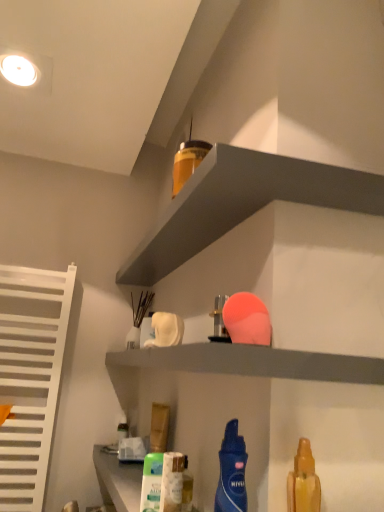
Measure the distance between blue matte lotion at center, which is counted as the 2th cleaning product, starting from the right, and camera.

A distance of 22.43 inches exists between blue matte lotion at center, which is counted as the 2th cleaning product, starting from the right, and camera.

The image size is (384, 512). Describe the element at coordinates (303, 481) in the screenshot. I see `translucent yellow spray bottle at lower right, arranged as the 4th cleaning product when viewed from the left` at that location.

Image resolution: width=384 pixels, height=512 pixels. I want to click on white slatted radiator at left, so 30,377.

What do you see at coordinates (172, 482) in the screenshot? This screenshot has height=512, width=384. I see `translucent plastic spray bottle at center, which is the 4th cleaning product from top to bottom` at bounding box center [172, 482].

Where is `matte gray shelf at upper center, positioned as the 2th shelf in bottom-to-top order`? Image resolution: width=384 pixels, height=512 pixels. matte gray shelf at upper center, positioned as the 2th shelf in bottom-to-top order is located at coordinates (242, 204).

From a real-world perspective, which cleaning product is the 3rd one underneath the white matte shelf at upper center, marked as the 2th shelf in a top-to-bottom arrangement? Please provide its 2D coordinates.

[(172, 482)]

From the image's perspective, is white matte shelf at upper center, the first shelf positioned from the bottom, above or below translucent plastic spray bottle at center, acting as the 4th cleaning product starting from the right?

From the image's perspective, white matte shelf at upper center, the first shelf positioned from the bottom, appears above translucent plastic spray bottle at center, acting as the 4th cleaning product starting from the right.

Is point (181, 354) positioned after point (181, 460)?

That is False.

Can you confirm if white matte shelf at upper center, the first shelf positioned from the bottom, is thinner than translucent plastic spray bottle at center, which is the 4th cleaning product from top to bottom?

In fact, white matte shelf at upper center, the first shelf positioned from the bottom, might be wider than translucent plastic spray bottle at center, which is the 4th cleaning product from top to bottom.

Can you see matte gray shelf at upper center, positioned as the 2th shelf in bottom-to-top order, touching translucent yellow spray bottle at lower right, the fourth cleaning product in the back-to-front sequence?

No, matte gray shelf at upper center, positioned as the 2th shelf in bottom-to-top order, is not making contact with translucent yellow spray bottle at lower right, the fourth cleaning product in the back-to-front sequence.

Is matte gray shelf at upper center, which is counted as the 1th shelf, starting from the top, oriented away from translucent yellow spray bottle at lower right, which ranks as the 1th cleaning product in right-to-left order?

That's not correct — matte gray shelf at upper center, which is counted as the 1th shelf, starting from the top, is not looking away from translucent yellow spray bottle at lower right, which ranks as the 1th cleaning product in right-to-left order.

How different are the orientations of matte gray shelf at upper center, positioned as the 2th shelf in bottom-to-top order, and translucent yellow spray bottle at lower right, arranged as the 4th cleaning product when viewed from the left, in degrees?

90 degrees separate the facing orientations of matte gray shelf at upper center, positioned as the 2th shelf in bottom-to-top order, and translucent yellow spray bottle at lower right, arranged as the 4th cleaning product when viewed from the left.

From a real-world perspective, between white slatted radiator at left and white matte shelf at upper center, marked as the 2th shelf in a top-to-bottom arrangement, who is vertically higher?

In real-world perspective, white matte shelf at upper center, marked as the 2th shelf in a top-to-bottom arrangement, is above.

Is white slatted radiator at left thinner than white matte shelf at upper center, marked as the 2th shelf in a top-to-bottom arrangement?

Yes.

Considering the positions of objects white slatted radiator at left and white matte shelf at upper center, marked as the 2th shelf in a top-to-bottom arrangement, in the image provided, who is in front, white slatted radiator at left or white matte shelf at upper center, marked as the 2th shelf in a top-to-bottom arrangement,?

white matte shelf at upper center, marked as the 2th shelf in a top-to-bottom arrangement.

Is white slatted radiator at left beside white matte shelf at upper center, the first shelf positioned from the bottom?

No.

Between white slatted radiator at left and translucent yellow spray bottle at lower right, which ranks as the 1th cleaning product in right-to-left order, which one has smaller size?

translucent yellow spray bottle at lower right, which ranks as the 1th cleaning product in right-to-left order.

Is white slatted radiator at left oriented away from translucent yellow spray bottle at lower right, positioned as the second cleaning product in bottom-to-top order?

white slatted radiator at left does not have its back to translucent yellow spray bottle at lower right, positioned as the second cleaning product in bottom-to-top order.

Can you confirm if white slatted radiator at left is positioned to the left of translucent yellow spray bottle at lower right, positioned as the second cleaning product in bottom-to-top order?

Yes.

Which is behind, point (22, 376) or point (301, 477)?

Positioned behind is point (22, 376).

Is blue matte lotion at center, the second cleaning product positioned from the top, facing away from translucent yellow spray bottle at lower right, which is the 1th cleaning product in front-to-back order?

Yes, blue matte lotion at center, the second cleaning product positioned from the top, is facing away from translucent yellow spray bottle at lower right, which is the 1th cleaning product in front-to-back order.

Considering the relative sizes of blue matte lotion at center, which is counted as the 2th cleaning product, starting from the right, and translucent yellow spray bottle at lower right, which ranks as the 1th cleaning product in right-to-left order, in the image provided, is blue matte lotion at center, which is counted as the 2th cleaning product, starting from the right, taller than translucent yellow spray bottle at lower right, which ranks as the 1th cleaning product in right-to-left order,?

Yes, blue matte lotion at center, which is counted as the 2th cleaning product, starting from the right, is taller than translucent yellow spray bottle at lower right, which ranks as the 1th cleaning product in right-to-left order.

Is point (214, 505) farther from viewer compared to point (295, 484)?

Yes, it is.

Would you consider blue matte lotion at center, placed as the 3th cleaning product when sorted from left to right, to be distant from translucent yellow spray bottle at lower right, arranged as the 4th cleaning product when viewed from the left?

Actually, blue matte lotion at center, placed as the 3th cleaning product when sorted from left to right, and translucent yellow spray bottle at lower right, arranged as the 4th cleaning product when viewed from the left, are a little close together.

Consider the image. From a real-world perspective, relative to white matte shelf at upper center, marked as the 2th shelf in a top-to-bottom arrangement, is matte gray shelf at upper center, positioned as the 2th shelf in bottom-to-top order, vertically above or below?

From a real-world perspective, matte gray shelf at upper center, positioned as the 2th shelf in bottom-to-top order, is physically above white matte shelf at upper center, marked as the 2th shelf in a top-to-bottom arrangement.

Is matte gray shelf at upper center, positioned as the 2th shelf in bottom-to-top order, situated inside white matte shelf at upper center, marked as the 2th shelf in a top-to-bottom arrangement, or outside?

matte gray shelf at upper center, positioned as the 2th shelf in bottom-to-top order, lies outside white matte shelf at upper center, marked as the 2th shelf in a top-to-bottom arrangement.

Considering the sizes of matte gray shelf at upper center, which is counted as the 1th shelf, starting from the top, and white matte shelf at upper center, the first shelf positioned from the bottom, in the image, is matte gray shelf at upper center, which is counted as the 1th shelf, starting from the top, wider or thinner than white matte shelf at upper center, the first shelf positioned from the bottom,?

Considering their sizes, matte gray shelf at upper center, which is counted as the 1th shelf, starting from the top, looks slimmer than white matte shelf at upper center, the first shelf positioned from the bottom.

Who is taller, matte gray shelf at upper center, which is counted as the 1th shelf, starting from the top, or white matte shelf at upper center, the first shelf positioned from the bottom?

With more height is white matte shelf at upper center, the first shelf positioned from the bottom.

Consider the image. Considering the positions of objects translucent plastic spray bottle at center, acting as the third cleaning product starting from the front, and white slatted radiator at left in the image provided, who is in front, translucent plastic spray bottle at center, acting as the third cleaning product starting from the front, or white slatted radiator at left?

translucent plastic spray bottle at center, acting as the third cleaning product starting from the front, is more forward.

Based on their sizes in the image, would you say translucent plastic spray bottle at center, the 1th cleaning product in the left-to-right sequence, is bigger or smaller than white slatted radiator at left?

In the image, translucent plastic spray bottle at center, the 1th cleaning product in the left-to-right sequence, appears to be smaller than white slatted radiator at left.

How much distance is there between translucent plastic spray bottle at center, the first cleaning product when ordered from bottom to top, and white slatted radiator at left?

The distance of translucent plastic spray bottle at center, the first cleaning product when ordered from bottom to top, from white slatted radiator at left is 32.66 inches.

Can you tell me how much translucent plastic spray bottle at center, acting as the third cleaning product starting from the front, and white slatted radiator at left differ in facing direction?

They differ by 90 degrees in their facing directions.

You are a GUI agent. You are given a task and a screenshot of the screen. Output one action in this format:
    pyautogui.click(x=<x>, y=<y>)
    Task: Click on the 1st shelf counting from the right side of the translucent plastic spray bottle at center, the 1th cleaning product in the left-to-right sequence
    The height and width of the screenshot is (512, 384).
    Given the screenshot: What is the action you would take?
    pyautogui.click(x=253, y=362)

From a real-world perspective, count 2nd shelfs upward from the translucent yellow spray bottle at lower right, arranged as the 4th cleaning product when viewed from the left, and point to it. Please provide its 2D coordinates.

[(242, 204)]

Estimate the real-world distances between objects in this image. Which object is further from translucent plastic spray bottle at center, acting as the third cleaning product starting from the front, translucent plastic bottle at upper center, the 2th cleaning product viewed from the left, or matte gray shelf at upper center, positioned as the 2th shelf in bottom-to-top order?

translucent plastic bottle at upper center, the 2th cleaning product viewed from the left, lies further to translucent plastic spray bottle at center, acting as the third cleaning product starting from the front, than the other object.

From the image, which object appears to be nearer to translucent plastic spray bottle at center, the first cleaning product when ordered from bottom to top, translucent yellow spray bottle at lower right, which is the 1th cleaning product in front-to-back order, or white slatted radiator at left?

translucent yellow spray bottle at lower right, which is the 1th cleaning product in front-to-back order, is closer to translucent plastic spray bottle at center, the first cleaning product when ordered from bottom to top.

Looking at this image, when comparing their distances from translucent yellow spray bottle at lower right, placed as the 3th cleaning product when sorted from top to bottom, does blue matte lotion at center, which is the 3th cleaning product in bottom-to-top order, or matte gray shelf at upper center, which is counted as the 1th shelf, starting from the top, seem further?

matte gray shelf at upper center, which is counted as the 1th shelf, starting from the top, is positioned further to the anchor translucent yellow spray bottle at lower right, placed as the 3th cleaning product when sorted from top to bottom.

When comparing their distances from white slatted radiator at left, does translucent yellow spray bottle at lower right, positioned as the second cleaning product in bottom-to-top order, or blue matte lotion at center, the 3th cleaning product from the back, seem closer?

The object closer to white slatted radiator at left is blue matte lotion at center, the 3th cleaning product from the back.

When comparing their distances from matte gray shelf at upper center, which is counted as the 1th shelf, starting from the top, does white matte shelf at upper center, marked as the 2th shelf in a top-to-bottom arrangement, or translucent plastic bottle at upper center, the 4th cleaning product positioned from the front, seem closer?

translucent plastic bottle at upper center, the 4th cleaning product positioned from the front, is positioned closer to the anchor matte gray shelf at upper center, which is counted as the 1th shelf, starting from the top.

From the image, which object appears to be farther from white matte shelf at upper center, the first shelf positioned from the bottom, translucent yellow spray bottle at lower right, positioned as the second cleaning product in bottom-to-top order, or blue matte lotion at center, the second cleaning product viewed from the front?

The object further to white matte shelf at upper center, the first shelf positioned from the bottom, is translucent yellow spray bottle at lower right, positioned as the second cleaning product in bottom-to-top order.

Which object lies nearer to the anchor point translucent plastic bottle at upper center, the 4th cleaning product positioned from the front, white matte shelf at upper center, the first shelf positioned from the bottom, or translucent plastic spray bottle at center, acting as the third cleaning product starting from the front?

white matte shelf at upper center, the first shelf positioned from the bottom.

Considering their positions, is white slatted radiator at left positioned further to translucent plastic spray bottle at center, which ranks as the second cleaning product in back-to-front order, than matte gray shelf at upper center, which is counted as the 1th shelf, starting from the top?

white slatted radiator at left.

This screenshot has height=512, width=384. What are the coordinates of `cleaning product that lies between translucent plastic bottle at upper center, the third cleaning product positioned from the right, and translucent yellow spray bottle at lower right, which ranks as the 1th cleaning product in right-to-left order, from top to bottom` in the screenshot? It's located at (232, 472).

At what (x,y) coordinates should I click in order to perform the action: click on shelf between matte gray shelf at upper center, positioned as the 2th shelf in bottom-to-top order, and blue matte lotion at center, placed as the 3th cleaning product when sorted from left to right, vertically. Please return your answer as a coordinate pair (x, y). Looking at the image, I should click on (253, 362).

What are the coordinates of `shelf between translucent plastic bottle at upper center, marked as the 1th cleaning product in a back-to-front arrangement, and white matte shelf at upper center, marked as the 2th shelf in a top-to-bottom arrangement, vertically` in the screenshot? It's located at (242, 204).

Locate an element on the screen. This screenshot has width=384, height=512. shelf between matte gray shelf at upper center, positioned as the 2th shelf in bottom-to-top order, and translucent plastic spray bottle at center, acting as the third cleaning product starting from the front, in the up-down direction is located at coordinates (253, 362).